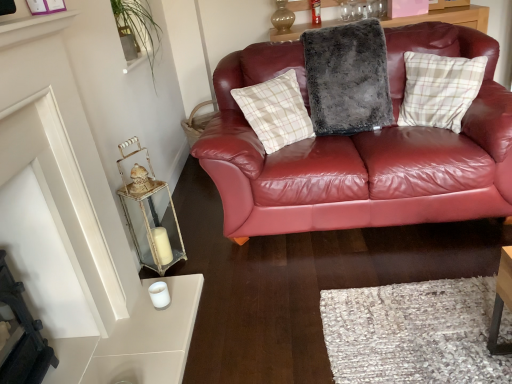
Question: In the image, is fuzzy gray pillow at center, the first pillow viewed from the left, positioned in front of or behind white glossy shelf at upper left?

Choices:
 (A) front
 (B) behind

Answer: (B)

Question: Considering the positions of fuzzy gray pillow at center, which is counted as the second pillow, starting from the right, and white glossy shelf at upper left in the image, is fuzzy gray pillow at center, which is counted as the second pillow, starting from the right, taller or shorter than white glossy shelf at upper left?

Choices:
 (A) short
 (B) tall

Answer: (B)

Question: Considering the real-world distances, which object is farthest from the white glossy shelf at upper left?

Choices:
 (A) metallic glass lantern at left
 (B) plaid fabric pillow at upper right, acting as the 1th pillow starting from the right
 (C) fuzzy gray pillow at center, the first pillow viewed from the left

Answer: (B)

Question: Estimate the real-world distances between objects in this image. Which object is closer to the metallic glass lantern at left?

Choices:
 (A) white glossy shelf at upper left
 (B) plaid fabric pillow at upper right, the 2th pillow from the left
 (C) fuzzy gray pillow at center, the first pillow viewed from the left

Answer: (A)